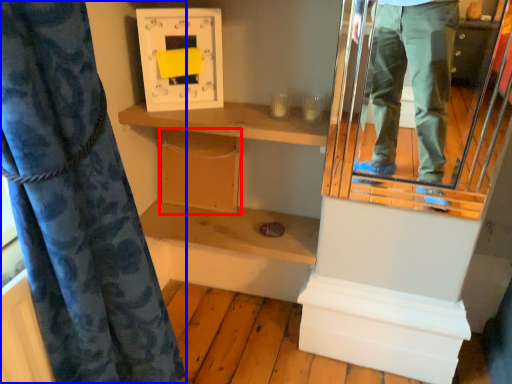
Question: Which object appears farthest to the camera in this image, cabinet (highlighted by a red box) or curtain (highlighted by a blue box)?

Choices:
 (A) cabinet
 (B) curtain

Answer: (A)